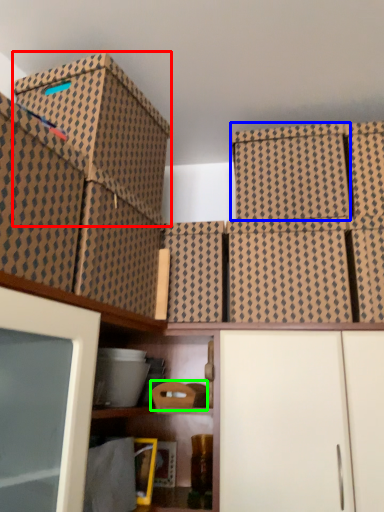
Question: Estimate the real-world distances between objects in this image. Which object is closer to storage box (highlighted by a red box), storage box (highlighted by a blue box) or storage box (highlighted by a green box)?

Choices:
 (A) storage box
 (B) storage box

Answer: (A)